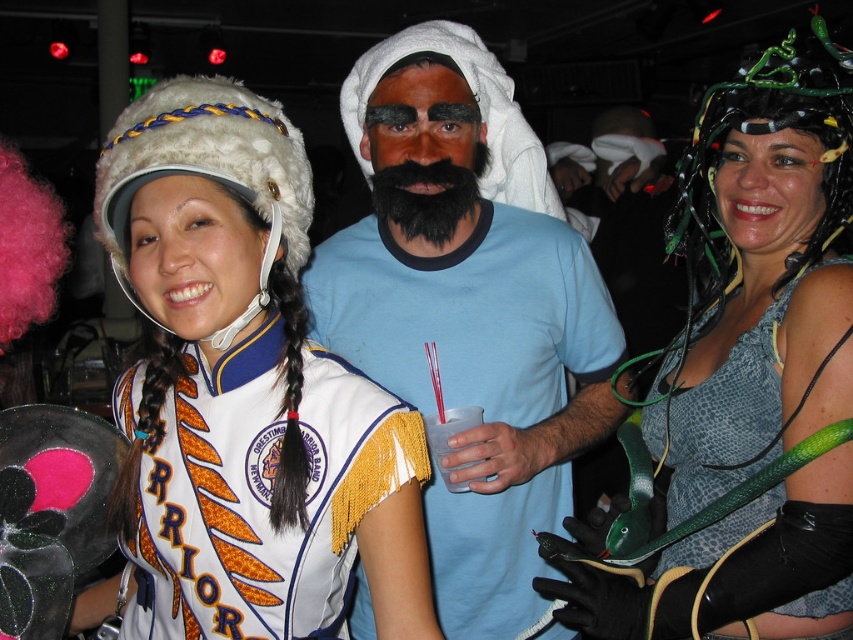
Question: Which point is farther to the camera?

Choices:
 (A) (456, 420)
 (B) (838, 304)

Answer: (A)

Question: Which object appears closest to the camera in this image?

Choices:
 (A) white fur hat at left
 (B) blue cotton shirt at center
 (C) green snake at right
 (D) clear plastic cup at center

Answer: (A)

Question: Does white fur hat at left appear on the right side of leather snakeskin dress at center?

Choices:
 (A) yes
 (B) no

Answer: (B)

Question: Estimate the real-world distances between objects in this image. Which object is closer to the leather snakeskin dress at center?

Choices:
 (A) green snake at right
 (B) black fuzzy beard at center

Answer: (A)

Question: Does green snake at right appear on the left side of clear plastic cup at center?

Choices:
 (A) no
 (B) yes

Answer: (A)

Question: Is black fuzzy beard at center to the left of clear plastic cup at center from the viewer's perspective?

Choices:
 (A) no
 (B) yes

Answer: (B)